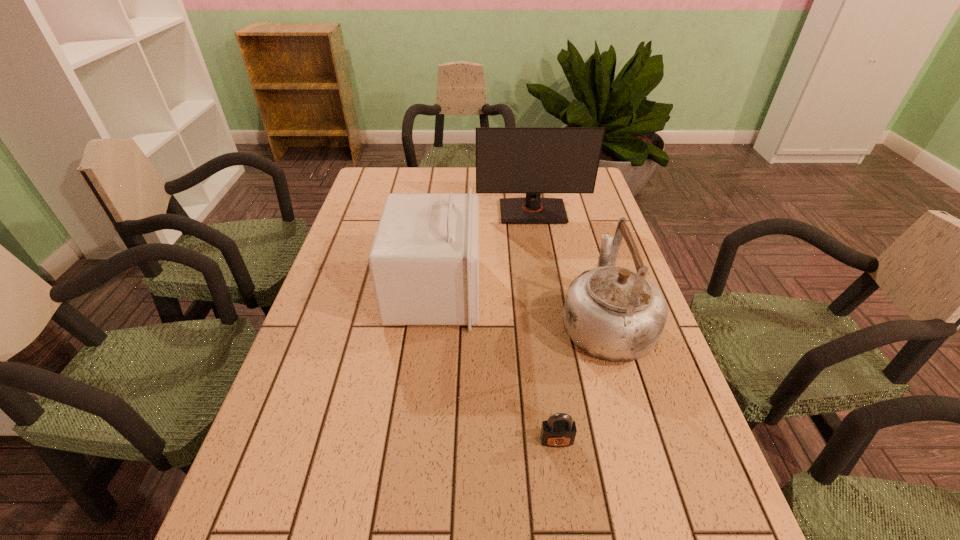
You are a GUI agent. You are given a task and a screenshot of the screen. Output one action in this format:
    pyautogui.click(x=<x>, y=<y>)
    Task: Click on the vacant space situated 0.100m on the front of the nearest object near the keyhole
    Image resolution: width=960 pixels, height=540 pixels.
    Given the screenshot: What is the action you would take?
    pyautogui.click(x=565, y=503)

You are a GUI agent. You are given a task and a screenshot of the screen. Output one action in this format:
    pyautogui.click(x=<x>, y=<y>)
    Task: Click on the object present at the far edge
    
    Given the screenshot: What is the action you would take?
    pyautogui.click(x=533, y=160)

You are a GUI agent. You are given a task and a screenshot of the screen. Output one action in this format:
    pyautogui.click(x=<x>, y=<y>)
    Task: Click on the monitor at the right edge
    Image resolution: width=960 pixels, height=540 pixels.
    Given the screenshot: What is the action you would take?
    [533, 160]

This screenshot has width=960, height=540. Identify the location of kettle at the right edge. (612, 313).

Image resolution: width=960 pixels, height=540 pixels. I want to click on object that is at the far right corner, so click(533, 160).

Find the location of a particular element. vacant space at the far edge is located at coordinates (449, 186).

Image resolution: width=960 pixels, height=540 pixels. What are the coordinates of `free space at the left edge of the desktop` in the screenshot? It's located at (354, 241).

At what (x,y) coordinates should I click in order to perform the action: click on vacant space at the right edge of the desktop. Please return your answer as a coordinate pair (x, y). Looking at the image, I should click on (643, 417).

The height and width of the screenshot is (540, 960). What are the coordinates of `free point at the far left corner` in the screenshot? It's located at (393, 174).

At what (x,y) coordinates should I click in order to perform the action: click on vacant point located between the first-aid kit and the padlock. Please return your answer as a coordinate pair (x, y). The image size is (960, 540). Looking at the image, I should click on pos(495,366).